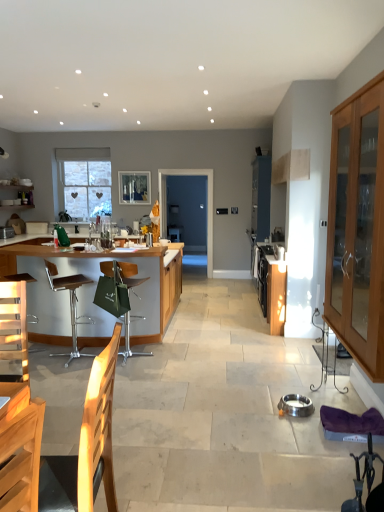
I want to click on silver metallic bowl at center, the 2th appliance from the right, so click(295, 405).

Identify the location of stainless steel oven at center-right, which appears as the 3th appliance when viewed from the left. Image resolution: width=384 pixels, height=512 pixels. click(279, 252).

Describe the element at coordinates (276, 296) in the screenshot. The image size is (384, 512). I see `wooden cabinet at center, the 1th cabinetry when ordered from back to front` at that location.

The height and width of the screenshot is (512, 384). Describe the element at coordinates (14, 328) in the screenshot. I see `wooden armchair at lower left` at that location.

The width and height of the screenshot is (384, 512). I want to click on wooden armchair at lower left, so click(14, 328).

The height and width of the screenshot is (512, 384). Describe the element at coordinates (70, 304) in the screenshot. I see `brown leather bar stool at left, which appears as the 1th chair when viewed from the left` at that location.

Where is `metallic silver toaster at left, arranged as the first appliance when viewed from the left`? The height and width of the screenshot is (512, 384). metallic silver toaster at left, arranged as the first appliance when viewed from the left is located at coordinates (6, 232).

This screenshot has width=384, height=512. I want to click on silver metallic bowl at center, the 2th appliance from the left, so click(x=295, y=405).

How different are the orientations of stainless steel oven at center-right, which ranks as the second appliance in bottom-to-top order, and brown leather bar stool at left, which appears as the 1th chair when viewed from the left, in degrees?

141 degrees.

Can you confirm if stainless steel oven at center-right, which appears as the 3th appliance when viewed from the left, is wider than brown leather bar stool at left, which is the 2th chair from right to left?

No.

Between stainless steel oven at center-right, marked as the 2th appliance in a back-to-front arrangement, and brown leather bar stool at left, which appears as the 1th chair when viewed from the left, which one has more height?

Standing taller between the two is brown leather bar stool at left, which appears as the 1th chair when viewed from the left.

Does stainless steel oven at center-right, the 1th appliance from the right, touch brown leather bar stool at left, which appears as the 1th chair when viewed from the left?

No, stainless steel oven at center-right, the 1th appliance from the right, is not beside brown leather bar stool at left, which appears as the 1th chair when viewed from the left.

Considering the relative positions of transparent glass door at center and wooden armchair at lower left in the image provided, is transparent glass door at center in front of wooden armchair at lower left?

No, transparent glass door at center is further to the viewer.

Is transparent glass door at center not near wooden armchair at lower left?

Yes.

Considering the sizes of objects transparent glass door at center and wooden armchair at lower left in the image provided, who is bigger, transparent glass door at center or wooden armchair at lower left?

With larger size is transparent glass door at center.

Between point (121, 177) and point (136, 352), which one is positioned behind?

Positioned behind is point (121, 177).

Considering the positions of objects clear glass window screen at upper center and green fabric chair at center, which is the 1th chair from right to left, in the image provided, who is in front, clear glass window screen at upper center or green fabric chair at center, which is the 1th chair from right to left,?

green fabric chair at center, which is the 1th chair from right to left, is in front.

From the image's perspective, does clear glass window screen at upper center appear higher than green fabric chair at center, the second chair positioned from the left?

Yes, from the image's perspective, clear glass window screen at upper center is over green fabric chair at center, the second chair positioned from the left.

Does clear glass window screen at upper center contain green fabric chair at center, the second chair positioned from the left?

That's incorrect, green fabric chair at center, the second chair positioned from the left, is not inside clear glass window screen at upper center.

Which object is wider, stainless steel oven at center-right, the second appliance viewed from the front, or light brown wooden cabinet at right, placed as the 3th cabinetry when sorted from back to front?

light brown wooden cabinet at right, placed as the 3th cabinetry when sorted from back to front.

Is stainless steel oven at center-right, which ranks as the second appliance in bottom-to-top order, aimed at light brown wooden cabinet at right, the first cabinetry from the front?

No, stainless steel oven at center-right, which ranks as the second appliance in bottom-to-top order, is not turned towards light brown wooden cabinet at right, the first cabinetry from the front.

Between stainless steel oven at center-right, the second appliance viewed from the front, and light brown wooden cabinet at right, placed as the 3th cabinetry when sorted from back to front, which one has larger size?

Bigger between the two is light brown wooden cabinet at right, placed as the 3th cabinetry when sorted from back to front.

How different are the orientations of stainless steel oven at center-right, which ranks as the second appliance in bottom-to-top order, and light brown wooden cabinet at right, the first cabinetry from the front, in degrees?

The facing directions of stainless steel oven at center-right, which ranks as the second appliance in bottom-to-top order, and light brown wooden cabinet at right, the first cabinetry from the front, are 0.493 degrees apart.

Which object is more forward, wooden armchair at lower left or clear glass window at upper left?

Positioned in front is wooden armchair at lower left.

Does wooden armchair at lower left have a larger size compared to clear glass window at upper left?

Incorrect, wooden armchair at lower left is not larger than clear glass window at upper left.

Is wooden armchair at lower left next to clear glass window at upper left and touching it?

No, wooden armchair at lower left is not with clear glass window at upper left.

Considering the sizes of wooden armchair at lower left and clear glass window at upper left in the image, is wooden armchair at lower left taller or shorter than clear glass window at upper left?

In the image, wooden armchair at lower left appears to be shorter than clear glass window at upper left.

Considering the sizes of metallic silver toaster at left, which is the 1th appliance in back-to-front order, and wooden cabinet at center, which ranks as the 2th cabinetry in right-to-left order, in the image, is metallic silver toaster at left, which is the 1th appliance in back-to-front order, wider or thinner than wooden cabinet at center, which ranks as the 2th cabinetry in right-to-left order,?

In the image, metallic silver toaster at left, which is the 1th appliance in back-to-front order, appears to be more narrow than wooden cabinet at center, which ranks as the 2th cabinetry in right-to-left order.

From the image's perspective, between metallic silver toaster at left, which is the 1th appliance in top-to-bottom order, and wooden cabinet at center, placed as the third cabinetry when sorted from front to back, which one is located above?

metallic silver toaster at left, which is the 1th appliance in top-to-bottom order.

Is point (0, 234) positioned before point (285, 319)?

That is False.

Is metallic silver toaster at left, the 3th appliance viewed from the right, looking in the opposite direction of wooden cabinet at center, the 2th cabinetry when ordered from left to right?

That's not correct — metallic silver toaster at left, the 3th appliance viewed from the right, is not looking away from wooden cabinet at center, the 2th cabinetry when ordered from left to right.

From the picture: Can you confirm if green fabric chair at center, the second chair positioned from the left, is positioned to the right of silver metallic bowl at center, which ranks as the first appliance in bottom-to-top order?

No.

Does green fabric chair at center, the second chair positioned from the left, turn towards silver metallic bowl at center, the 2th appliance from the left?

No, green fabric chair at center, the second chair positioned from the left, is not turned towards silver metallic bowl at center, the 2th appliance from the left.

Considering their positions, is green fabric chair at center, the second chair positioned from the left, located in front of or behind silver metallic bowl at center, which ranks as the first appliance in bottom-to-top order?

Clearly, green fabric chair at center, the second chair positioned from the left, is behind silver metallic bowl at center, which ranks as the first appliance in bottom-to-top order.

From a real-world perspective, is green fabric chair at center, the second chair positioned from the left, physically below silver metallic bowl at center, which ranks as the first appliance in bottom-to-top order?

No, from a real-world perspective, green fabric chair at center, the second chair positioned from the left, is not below silver metallic bowl at center, which ranks as the first appliance in bottom-to-top order.

I want to click on appliance that is the 1st object above the brown leather bar stool at left, which is the 2th chair from right to left (from a real-world perspective), so click(279, 252).

Where is `glass door behind the wooden armchair at lower left`? The height and width of the screenshot is (512, 384). glass door behind the wooden armchair at lower left is located at coordinates (207, 203).

Consider the image. Looking at the image, which one is located closer to wooden bar counter at left, positioned as the second cabinetry in front-to-back order, clear glass window at upper left or transparent glass door at center?

The object closer to wooden bar counter at left, positioned as the second cabinetry in front-to-back order, is clear glass window at upper left.

From the image, which object appears to be farther from wooden bar counter at left, which is counted as the 3th cabinetry, starting from the right, metallic silver toaster at left, the 3th appliance viewed from the right, or green fabric chair at center, the second chair positioned from the left?

metallic silver toaster at left, the 3th appliance viewed from the right, is further to wooden bar counter at left, which is counted as the 3th cabinetry, starting from the right.

Based on their spatial positions, is brown leather bar stool at left, which is the 2th chair from right to left, or metallic silver toaster at left, arranged as the first appliance when viewed from the left, closer to transparent glass door at center?

Based on the image, metallic silver toaster at left, arranged as the first appliance when viewed from the left, appears to be nearer to transparent glass door at center.

From the image, which object appears to be farther from wooden bar counter at left, the first cabinetry when ordered from left to right, stainless steel oven at center-right, which appears as the 3th appliance when viewed from the left, or clear glass window at upper left?

The object further to wooden bar counter at left, the first cabinetry when ordered from left to right, is clear glass window at upper left.

From the picture: Based on their spatial positions, is clear glass window screen at upper center or green fabric chair at center, the second chair positioned from the left, closer to wooden armchair at lower left?

green fabric chair at center, the second chair positioned from the left, is positioned closer to the anchor wooden armchair at lower left.

From the image, which object appears to be farther from transparent glass door at center, green fabric chair at center, the second chair positioned from the left, or wooden armchair at lower left?

wooden armchair at lower left is positioned further to the anchor transparent glass door at center.

Looking at the image, which one is located closer to transparent glass door at center, light brown wooden cabinet at right, marked as the 3th cabinetry in a left-to-right arrangement, or wooden bar counter at left, the first cabinetry when ordered from left to right?

The object closer to transparent glass door at center is wooden bar counter at left, the first cabinetry when ordered from left to right.

Considering their positions, is transparent glass door at center positioned closer to brown leather bar stool at left, which appears as the 1th chair when viewed from the left, than silver metallic bowl at center, the 2th appliance from the right?

Based on the image, silver metallic bowl at center, the 2th appliance from the right, appears to be nearer to brown leather bar stool at left, which appears as the 1th chair when viewed from the left.

This screenshot has width=384, height=512. I want to click on cabinetry between wooden armchair at lower left and silver metallic bowl at center, which ranks as the first appliance in bottom-to-top order, so click(x=96, y=282).

This screenshot has height=512, width=384. What are the coordinates of `window screen situated between clear glass window at upper left and transparent glass door at center from left to right` in the screenshot? It's located at (134, 187).

Where is `cabinetry between stainless steel oven at center-right, marked as the 2th appliance in a back-to-front arrangement, and transparent glass door at center from front to back`? Image resolution: width=384 pixels, height=512 pixels. cabinetry between stainless steel oven at center-right, marked as the 2th appliance in a back-to-front arrangement, and transparent glass door at center from front to back is located at coordinates (276, 296).

Locate an element on the screen. glass door located between wooden cabinet at center, the 1th cabinetry when ordered from back to front, and clear glass window screen at upper center in the depth direction is located at coordinates (207, 203).